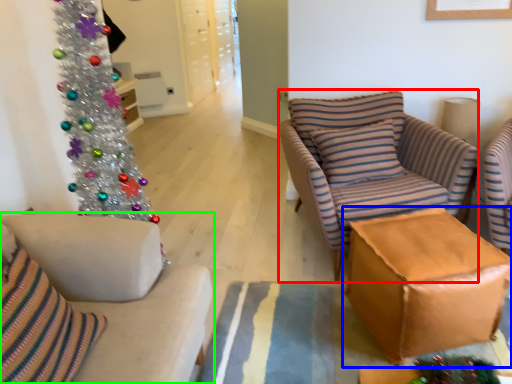
Question: Based on their relative distances, which object is farther from rocking chair (highlighted by a red box)? Choose from table (highlighted by a blue box) and studio couch (highlighted by a green box).

Choices:
 (A) table
 (B) studio couch

Answer: (B)